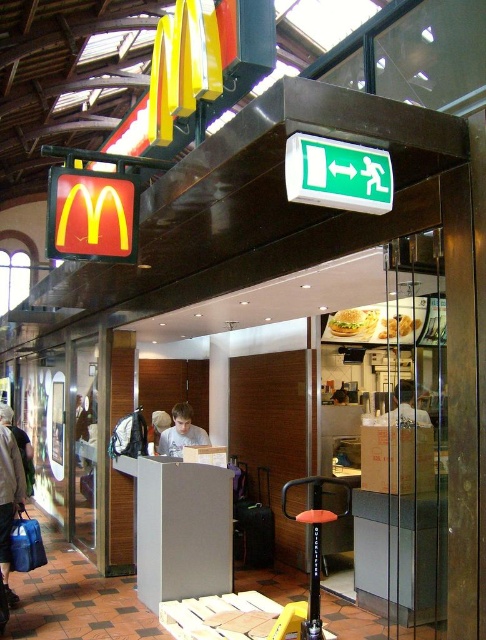
Consider the image. You are a customer entering McDonalds and see a denim jacket at lower left and a light brown hair at center. Which object is bigger?

The denim jacket at lower left is larger in size than the light brown hair at center.

In the scene shown: You are a customer standing at the entrance of the McDonalds. You see a person with light brown hair at center and a light brown leather jacket at center. Which object is bigger?

The light brown hair at center is larger than the light brown leather jacket at center.